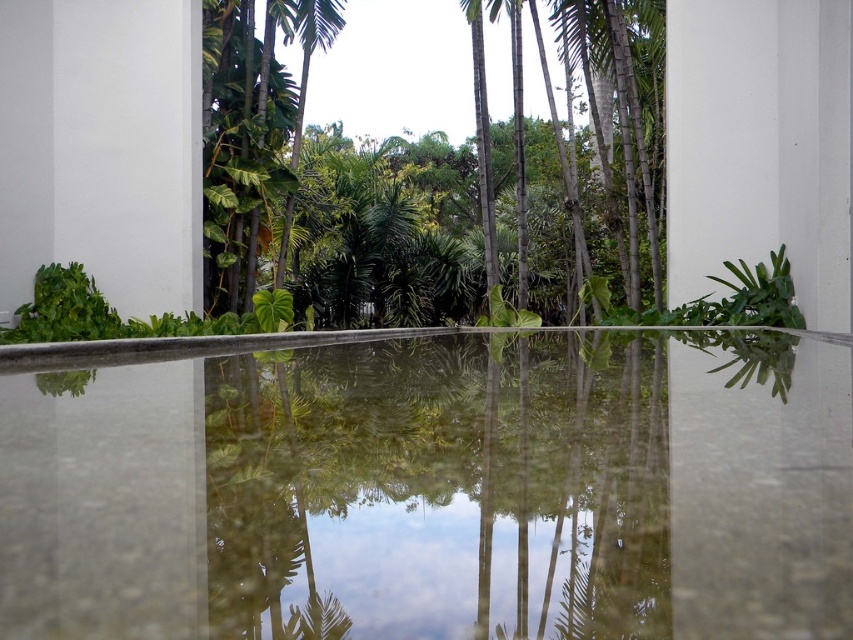
Question: Is clear water at center closer to the viewer compared to green leafy tree at center?

Choices:
 (A) no
 (B) yes

Answer: (B)

Question: Which point is closer to the camera?

Choices:
 (A) (544, 192)
 (B) (519, 372)

Answer: (B)

Question: Can you confirm if clear water at center is wider than green leafy tree at center?

Choices:
 (A) yes
 (B) no

Answer: (B)

Question: Which object appears farthest from the camera in this image?

Choices:
 (A) clear water at center
 (B) green leafy tree at center

Answer: (B)

Question: Which point appears farthest from the camera in this image?

Choices:
 (A) (341, 406)
 (B) (486, 193)

Answer: (B)

Question: Is clear water at center above green leafy tree at center?

Choices:
 (A) no
 (B) yes

Answer: (A)